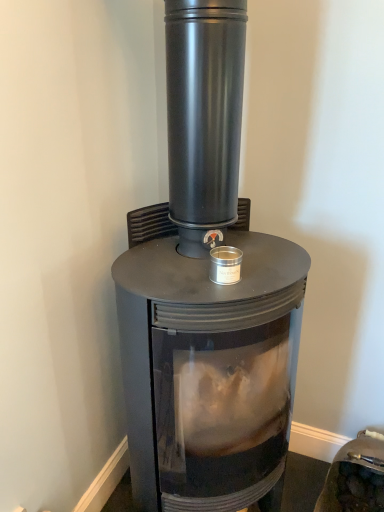
Image resolution: width=384 pixels, height=512 pixels. What do you see at coordinates (206, 295) in the screenshot? I see `black matte wood burning stove at center` at bounding box center [206, 295].

In order to face black matte wood burning stove at center, should I rotate leftwards or rightwards?

To align with it, rotate right about 2.764°.

Find the location of a particular element. The image size is (384, 512). black matte wood burning stove at center is located at coordinates (206, 295).

The image size is (384, 512). What do you see at coordinates (355, 476) in the screenshot?
I see `matte black stove at center` at bounding box center [355, 476].

You are a GUI agent. You are given a task and a screenshot of the screen. Output one action in this format:
    pyautogui.click(x=<x>, y=<y>)
    Task: Click on the matte black stove at center
    The height and width of the screenshot is (512, 384).
    Given the screenshot: What is the action you would take?
    pyautogui.click(x=355, y=476)

You are a GUI agent. You are given a task and a screenshot of the screen. Output one action in this format:
    pyautogui.click(x=<x>, y=<y>)
    Task: Click on the black matte wood burning stove at center
    The height and width of the screenshot is (512, 384).
    Given the screenshot: What is the action you would take?
    pyautogui.click(x=206, y=295)

Is black matte wood burning stove at center to the left of matte black stove at center from the viewer's perspective?

Correct, you'll find black matte wood burning stove at center to the left of matte black stove at center.

Which object is further away from the camera taking this photo, black matte wood burning stove at center or matte black stove at center?

matte black stove at center is more distant.

Is point (123, 317) farther from viewer compared to point (370, 455)?

No, (123, 317) is in front of (370, 455).

From the image's perspective, is black matte wood burning stove at center located above or below matte black stove at center?

Clearly, from the image's perspective, black matte wood burning stove at center is above matte black stove at center.

From a real-world perspective, is black matte wood burning stove at center under matte black stove at center?

No, from a real-world perspective, black matte wood burning stove at center is not under matte black stove at center.

Does black matte wood burning stove at center have a greater width compared to matte black stove at center?

Indeed, black matte wood burning stove at center has a greater width compared to matte black stove at center.

Considering the sizes of objects black matte wood burning stove at center and matte black stove at center in the image provided, who is taller, black matte wood burning stove at center or matte black stove at center?

With more height is black matte wood burning stove at center.

From the picture: Looking at the image, does black matte wood burning stove at center seem bigger or smaller compared to matte black stove at center?

Clearly, black matte wood burning stove at center is larger in size than matte black stove at center.

Would you say black matte wood burning stove at center is outside matte black stove at center?

That's correct, black matte wood burning stove at center is outside of matte black stove at center.

Does black matte wood burning stove at center touch matte black stove at center?

No, black matte wood burning stove at center is not beside matte black stove at center.

Is black matte wood burning stove at center facing towards matte black stove at center?

No, black matte wood burning stove at center is not facing towards matte black stove at center.

How many degrees apart are the facing directions of black matte wood burning stove at center and matte black stove at center?

There is a 1.34-degree angle between the facing directions of black matte wood burning stove at center and matte black stove at center.

Where is `appliance that is on the right side of black matte wood burning stove at center`? The width and height of the screenshot is (384, 512). appliance that is on the right side of black matte wood burning stove at center is located at coordinates (355, 476).

Is matte black stove at center at the right side of black matte wood burning stove at center?

Yes, matte black stove at center is to the right of black matte wood burning stove at center.

Is matte black stove at center in front of or behind black matte wood burning stove at center in the image?

matte black stove at center is positioned farther from the viewer than black matte wood burning stove at center.

Is point (367, 510) closer or farther from the camera than point (283, 287)?

Clearly, point (367, 510) is more distant from the camera than point (283, 287).

From the image's perspective, which one is positioned higher, matte black stove at center or black matte wood burning stove at center?

black matte wood burning stove at center.

From a real-world perspective, who is located higher, matte black stove at center or black matte wood burning stove at center?

In real-world perspective, black matte wood burning stove at center is above.

Which object is thinner, matte black stove at center or black matte wood burning stove at center?

Thinner between the two is matte black stove at center.

Which of these two, matte black stove at center or black matte wood burning stove at center, stands shorter?

matte black stove at center.

Considering the relative sizes of matte black stove at center and black matte wood burning stove at center in the image provided, is matte black stove at center bigger than black matte wood burning stove at center?

Incorrect, matte black stove at center is not larger than black matte wood burning stove at center.

Is black matte wood burning stove at center inside matte black stove at center?

No.

In the scene shown: Would you consider matte black stove at center to be distant from black matte wood burning stove at center?

No.

Is matte black stove at center oriented away from black matte wood burning stove at center?

That's not correct — matte black stove at center is not looking away from black matte wood burning stove at center.

How different are the orientations of matte black stove at center and black matte wood burning stove at center in degrees?

matte black stove at center and black matte wood burning stove at center are facing 1.34 degrees away from each other.

Find the location of a particular element. wood burning stove in front of the matte black stove at center is located at coordinates (206, 295).

You are a GUI agent. You are given a task and a screenshot of the screen. Output one action in this format:
    pyautogui.click(x=<x>, y=<y>)
    Task: Click on the appliance that is below the black matte wood burning stove at center (from the image's perspective)
    The width and height of the screenshot is (384, 512).
    Given the screenshot: What is the action you would take?
    [355, 476]

Find the location of a particular element. The image size is (384, 512). wood burning stove above the matte black stove at center (from a real-world perspective) is located at coordinates (206, 295).